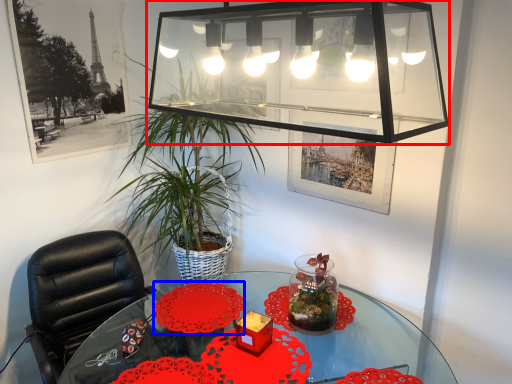
Question: Which object appears closest to the camera in this image, glass box (highlighted by a red box) or flower (highlighted by a blue box)?

Choices:
 (A) glass box
 (B) flower

Answer: (A)